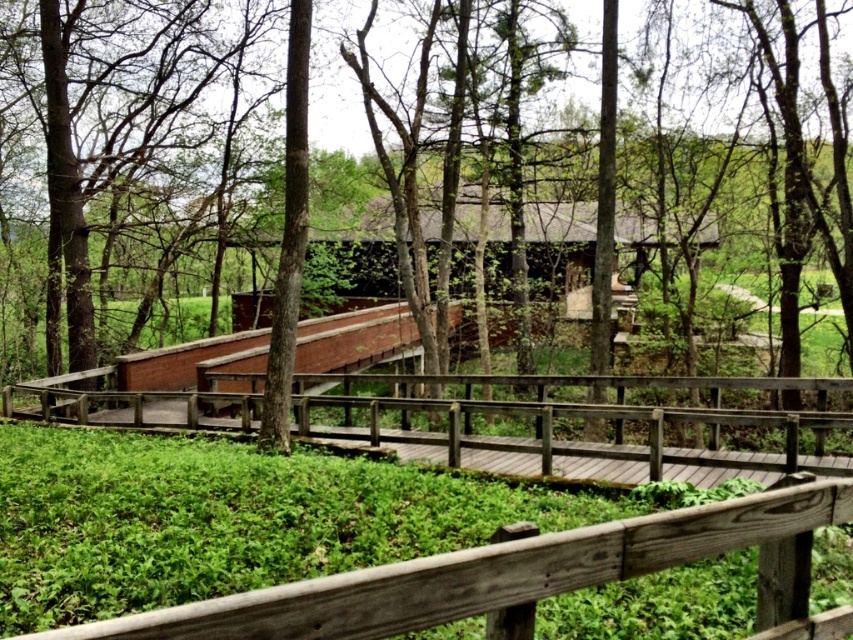
Question: Can you confirm if wooden bridge at center is wider than brown wood tree at center?

Choices:
 (A) no
 (B) yes

Answer: (A)

Question: Which of the following is the farthest from the observer?

Choices:
 (A) wooden bridge at center
 (B) brown wood tree at center

Answer: (B)

Question: Which object is farther from the camera taking this photo?

Choices:
 (A) brown wood tree at center
 (B) wooden bridge at center

Answer: (A)

Question: Does wooden bridge at center come in front of brown wood tree at center?

Choices:
 (A) yes
 (B) no

Answer: (A)

Question: Considering the relative positions of wooden bridge at center and brown wood tree at center in the image provided, where is wooden bridge at center located with respect to brown wood tree at center?

Choices:
 (A) right
 (B) left

Answer: (B)

Question: Which point appears closest to the camera in this image?

Choices:
 (A) (819, 216)
 (B) (115, 420)

Answer: (B)